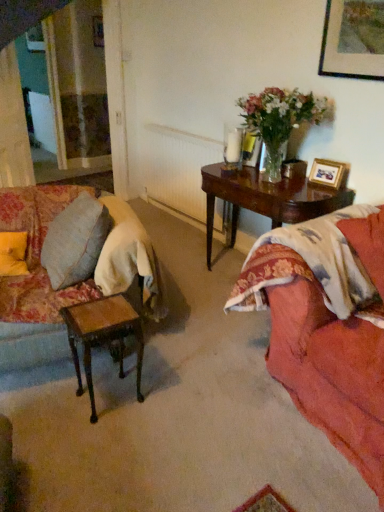
Where is `free space above wooden side table at lower left (from a real-world perspective)`? free space above wooden side table at lower left (from a real-world perspective) is located at coordinates (107, 312).